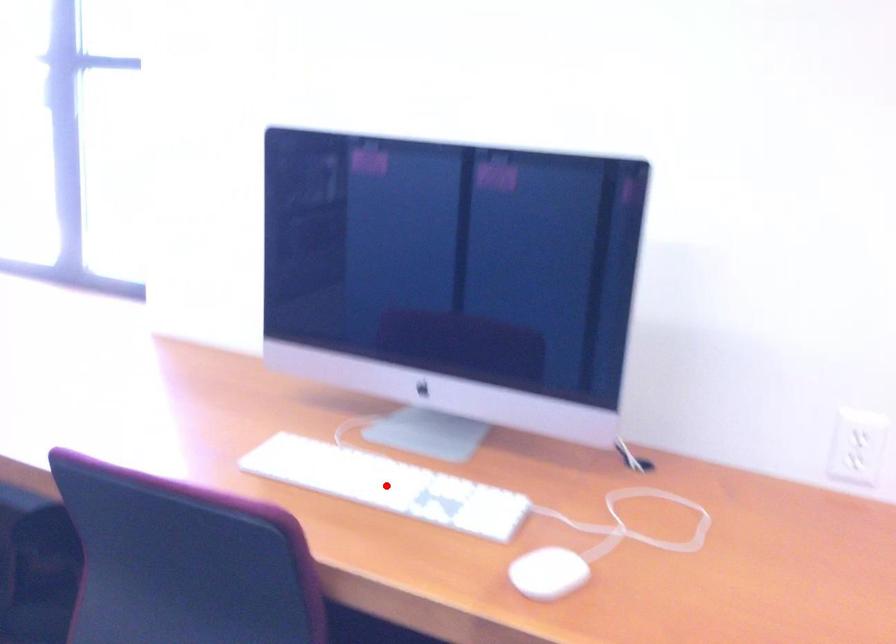
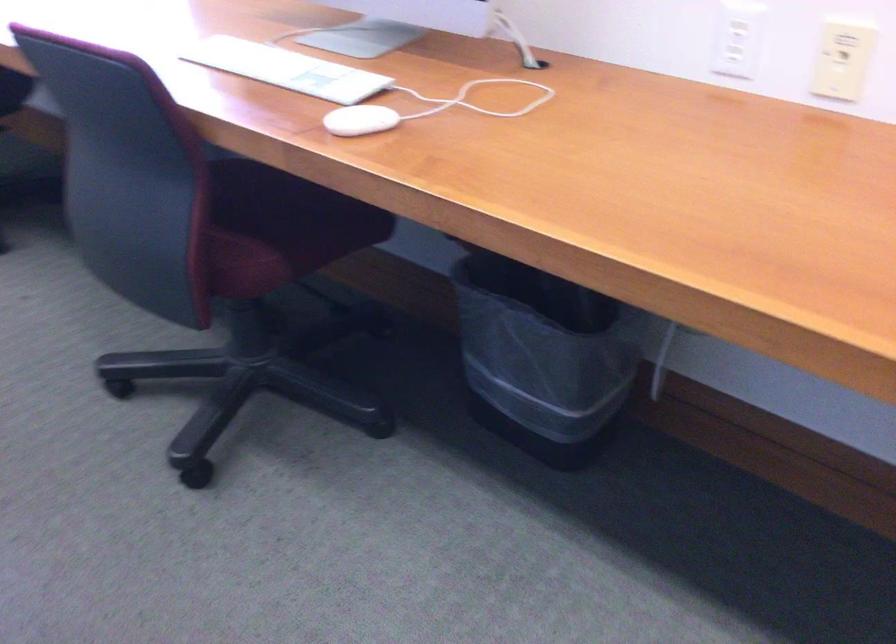
Find the pixel in the second image that matches the highlighted location in the first image.

(286, 69)